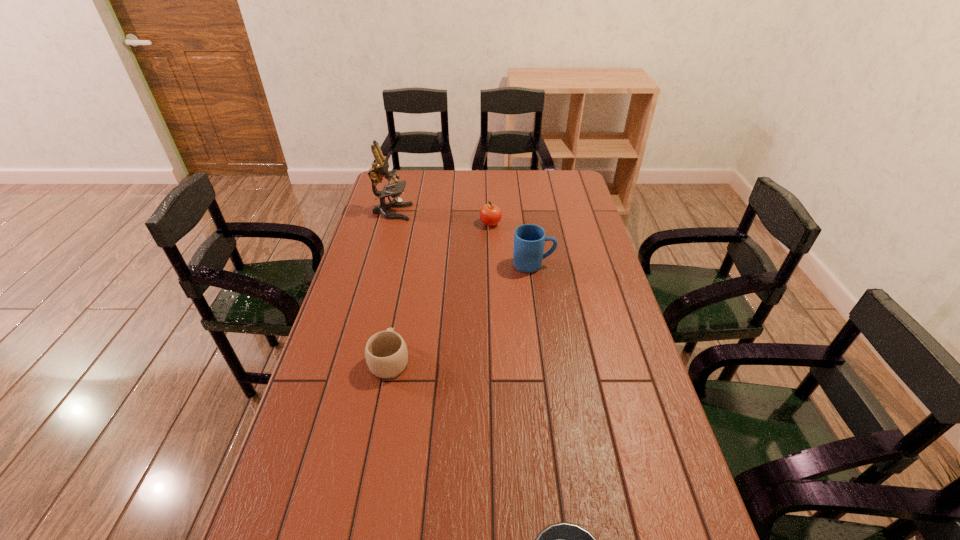
Identify the location of microscope. The image size is (960, 540). (380, 168).

Identify the location of the fourth shortest object. The height and width of the screenshot is (540, 960). (529, 239).

Where is `the farther mug`? The height and width of the screenshot is (540, 960). the farther mug is located at coordinates (529, 239).

This screenshot has width=960, height=540. I want to click on the third tallest object, so click(490, 214).

Identify the location of the third object from left to right. Image resolution: width=960 pixels, height=540 pixels. (490, 214).

Identify the location of the shorter mug. The height and width of the screenshot is (540, 960). (386, 354).

Where is `the fourth farthest object`? The image size is (960, 540). the fourth farthest object is located at coordinates (386, 354).

I want to click on free location located 0.050m at the eyepieces of the tallest object, so click(423, 212).

The width and height of the screenshot is (960, 540). I want to click on free point located 0.070m on the side of the farther mug with the handle, so click(x=574, y=265).

Find the location of a particular element. The width and height of the screenshot is (960, 540). vacant space located 0.300m on the right of the apple is located at coordinates (576, 224).